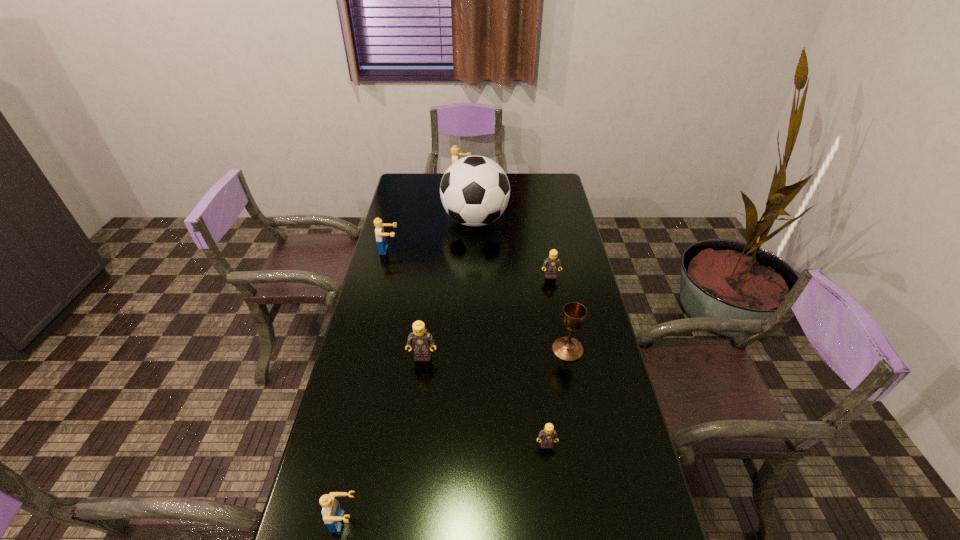
You are a GUI agent. You are given a task and a screenshot of the screen. Output one action in this format:
    pyautogui.click(x=<x>, y=<y>)
    Task: Click on the vacant space located 0.210m on the face of the nearest object
    Image resolution: width=960 pixels, height=540 pixels.
    Given the screenshot: What is the action you would take?
    pyautogui.click(x=451, y=522)

Where is `free location located 0.220m in front of the second biggest tan Lego`? free location located 0.220m in front of the second biggest tan Lego is located at coordinates (559, 322).

Locate an element on the screen. This screenshot has width=960, height=540. vacant area located in front of the shortest object is located at coordinates pyautogui.click(x=550, y=476).

The image size is (960, 540). I want to click on object present at the far edge, so click(455, 153).

At what (x,y) coordinates should I click in order to perform the action: click on chalice present at the right edge. Please return your answer as a coordinate pair (x, y). Looking at the image, I should click on (574, 314).

Find the location of a particular element. The width and height of the screenshot is (960, 540). Lego located at the right edge is located at coordinates (552, 263).

You are a GUI agent. You are given a task and a screenshot of the screen. Output one action in this format:
    pyautogui.click(x=<x>, y=<y>)
    Task: Click on the free space at the far edge of the desktop
    This screenshot has height=540, width=960.
    Given the screenshot: What is the action you would take?
    pyautogui.click(x=517, y=197)

Find the location of a particular element. vacant space at the left edge of the desktop is located at coordinates (380, 272).

Identify the location of vacant space at the right edge of the desktop. The width and height of the screenshot is (960, 540). (598, 351).

At what (x,y) coordinates should I click in order to perform the action: click on vacant space at the far right corner. Please return your answer as a coordinate pair (x, y). This screenshot has height=540, width=960. Looking at the image, I should click on (558, 173).